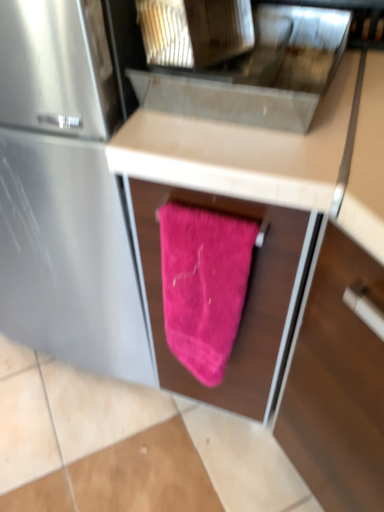
Find the location of a particular element. free point above pink fabric at center (from a real-world perspective) is located at coordinates (273, 69).